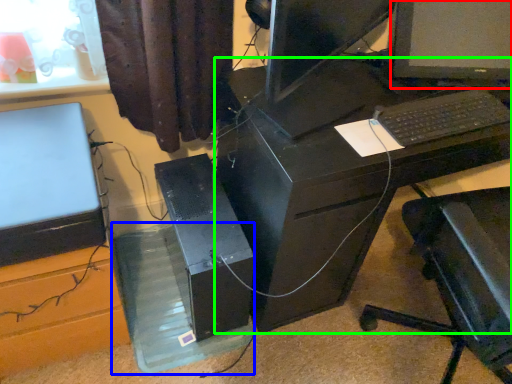
Question: Considering the real-world distances, which object is closest to computer monitor (highlighted by a red box)? glass box (highlighted by a blue box) or desk (highlighted by a green box).

Choices:
 (A) glass box
 (B) desk

Answer: (B)